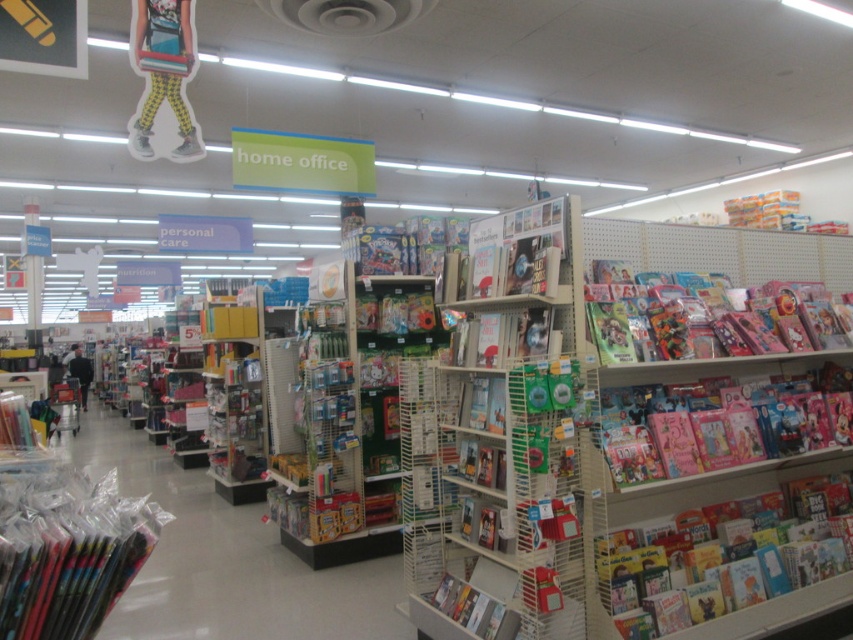
Question: Which of these objects is positioned closest to the black fabric shopping cart at lower left?

Choices:
 (A) matte pink book at right
 (B) matte plastic toys at center

Answer: (B)

Question: Which object appears farthest from the camera in this image?

Choices:
 (A) matte pink book at right
 (B) matte cardboard magazine at lower center
 (C) matte plastic toys at center

Answer: (A)

Question: Is white cardboard books at center above matte yellow and black checkered pants at upper center?

Choices:
 (A) yes
 (B) no

Answer: (B)

Question: Which object is positioned closest to the white cardboard books at center?

Choices:
 (A) black fabric shopping cart at lower left
 (B) matte cardboard magazine at lower center

Answer: (B)

Question: Does matte pink book at right have a smaller size compared to matte cardboard magazine at lower center?

Choices:
 (A) yes
 (B) no

Answer: (B)

Question: Does matte yellow and black checkered pants at upper center have a smaller size compared to matte cardboard magazine at lower center?

Choices:
 (A) yes
 (B) no

Answer: (B)